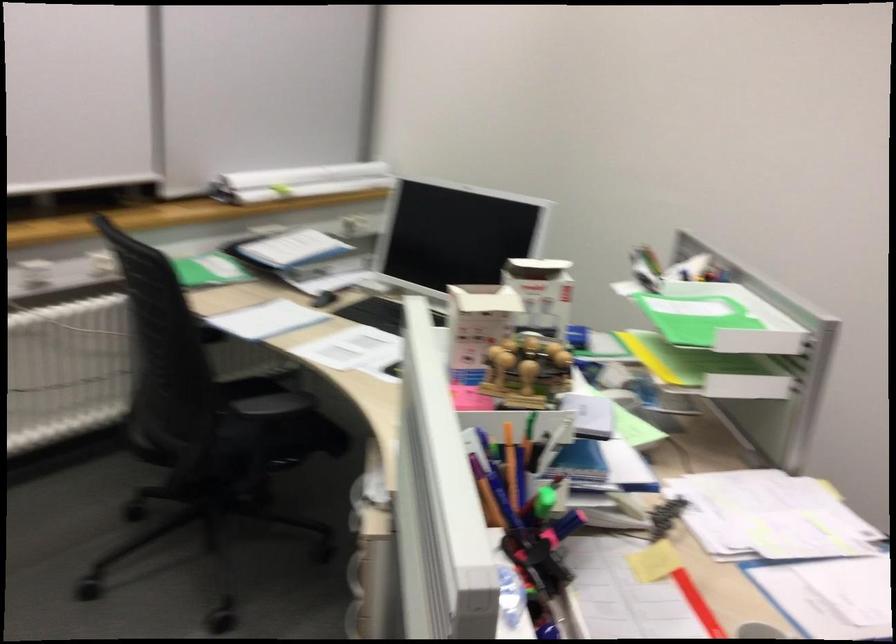
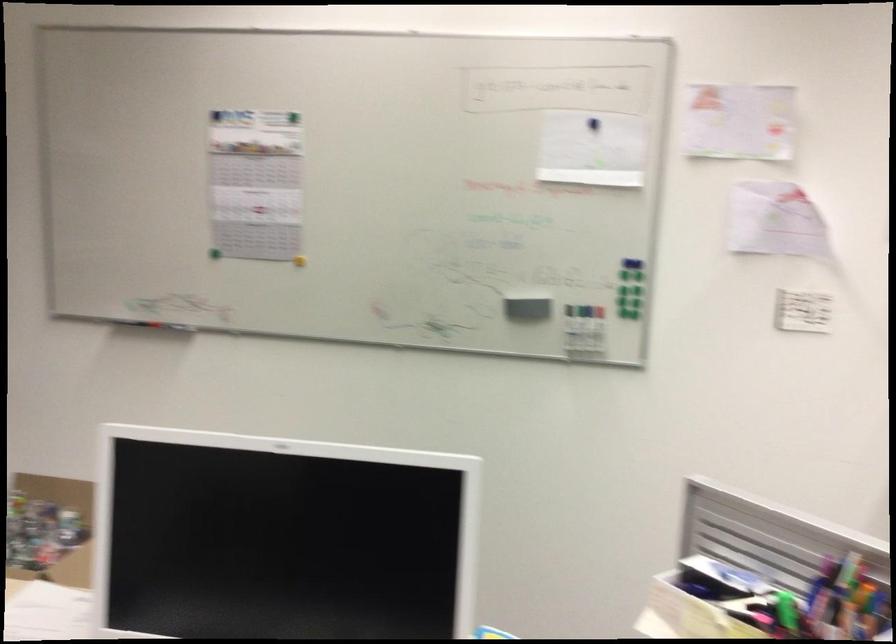
The point at (487, 507) is marked in the first image. Where is the corresponding point in the second image?

(787, 610)